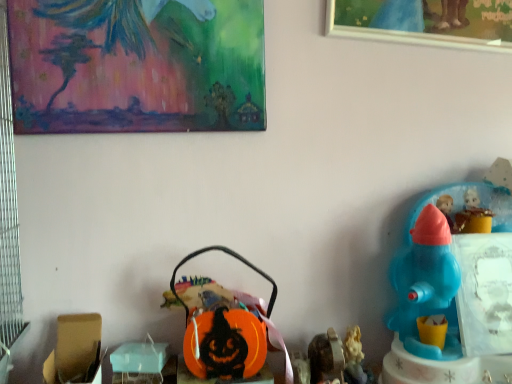
Question: Does blue plastic toy at right, placed as the 1th toy when sorted from right to left, touch metallic silver toy at lower center, the 3th toy from the right?

Choices:
 (A) yes
 (B) no

Answer: (B)

Question: Is blue plastic toy at right, placed as the 1th toy when sorted from right to left, smaller than metallic silver toy at lower center, the 3th toy from the right?

Choices:
 (A) yes
 (B) no

Answer: (B)

Question: From a real-world perspective, is blue plastic toy at right, placed as the fifth toy when sorted from left to right, physically above metallic silver toy at lower center, the 3th toy from the right?

Choices:
 (A) no
 (B) yes

Answer: (B)

Question: Is blue plastic toy at right, placed as the 1th toy when sorted from right to left, behind metallic silver toy at lower center, marked as the third toy in a left-to-right arrangement?

Choices:
 (A) yes
 (B) no

Answer: (B)

Question: Is blue plastic toy at right, placed as the 1th toy when sorted from right to left, completely or partially outside of metallic silver toy at lower center, the 3th toy from the right?

Choices:
 (A) no
 (B) yes

Answer: (B)

Question: Considering the relative positions of blue plastic toy at right, placed as the fifth toy when sorted from left to right, and metallic silver toy at lower center, marked as the third toy in a left-to-right arrangement, in the image provided, is blue plastic toy at right, placed as the fifth toy when sorted from left to right, in front of metallic silver toy at lower center, marked as the third toy in a left-to-right arrangement,?

Choices:
 (A) no
 (B) yes

Answer: (B)

Question: Would you say orange plastic basket at center, which appears as the 4th toy when viewed from the right, is outside painted canvas at upper left, arranged as the first picture frame when viewed from the left?

Choices:
 (A) yes
 (B) no

Answer: (A)

Question: Are orange plastic basket at center, the 2th toy in the left-to-right sequence, and painted canvas at upper left, arranged as the first picture frame when viewed from the left, making contact?

Choices:
 (A) yes
 (B) no

Answer: (B)

Question: Is orange plastic basket at center, which appears as the 4th toy when viewed from the right, further to camera compared to painted canvas at upper left, arranged as the first picture frame when viewed from the left?

Choices:
 (A) no
 (B) yes

Answer: (B)

Question: Is painted canvas at upper left, arranged as the first picture frame when viewed from the left, a part of orange plastic basket at center, the 2th toy in the left-to-right sequence?

Choices:
 (A) yes
 (B) no

Answer: (B)

Question: Does orange plastic basket at center, the 2th toy in the left-to-right sequence, turn towards painted canvas at upper left, arranged as the first picture frame when viewed from the left?

Choices:
 (A) no
 (B) yes

Answer: (A)

Question: Is there a large distance between orange plastic basket at center, which appears as the 4th toy when viewed from the right, and painted canvas at upper left, arranged as the first picture frame when viewed from the left?

Choices:
 (A) yes
 (B) no

Answer: (B)

Question: Is blue plastic toy at right, placed as the fifth toy when sorted from left to right, in contact with orange plastic basket at center, the 2th toy in the left-to-right sequence?

Choices:
 (A) yes
 (B) no

Answer: (B)